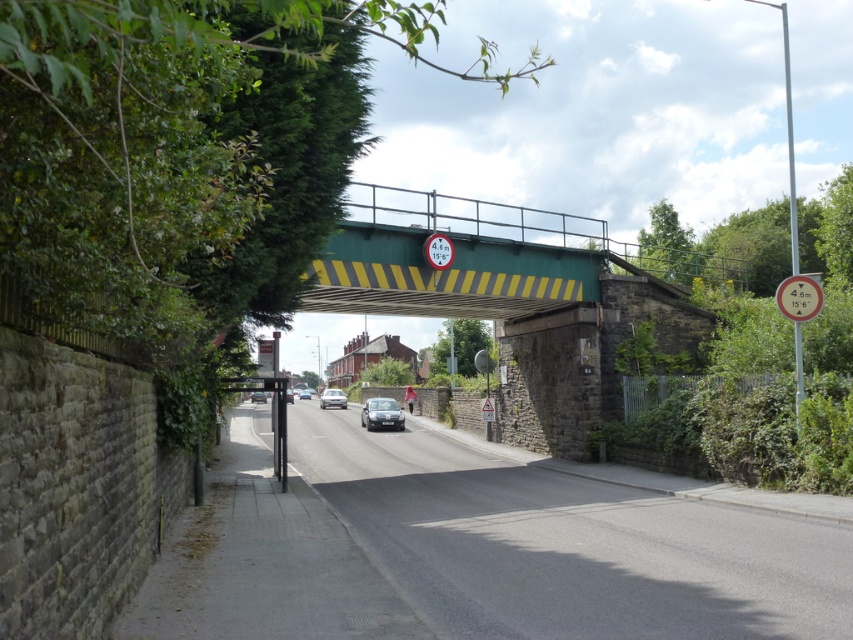
You are standing at the point marked by coordinates point [343,396] in the image. A car is approaching the railway bridge ahead. The bridge has a height restriction of 4.6 meters. Your vehicle is 4.5 meters tall. Can you safely pass under the bridge without hitting the overhead structure?

The point marked by coordinates point [343,396] is 198.72 feet away from the viewer. Since your vehicle is 4.5 meters tall, which is under the 4.6 meter clearance, you can safely pass under the bridge as long as there are no other obstacles in the path between your current position and the bridge.

You are driving a truck that is 4.5 meters tall. You come across the green painted steel bridge at center. Based on the scene, can your truck safely pass under the bridge without hitting it?

The red circular sign on the bridge shows a maximum height of 4.6 meters. Since your truck is 4.5 meters tall, which is under the 4.6m limit, it should safely pass under the green painted steel bridge at center.

You are driving a truck that is 4.5 meters tall. You need to pass under the railway bridge shown in the scene. There is a silver metallic car at center. Can your truck safely pass under the bridge without hitting it? Please explain your reasoning.

The railway bridge has a height clearance of 4.6 meters as indicated by the red circular sign. Your truck is 4.5 meters tall, which is below the maximum allowed height. Therefore, your truck can safely pass under the bridge without hitting it.